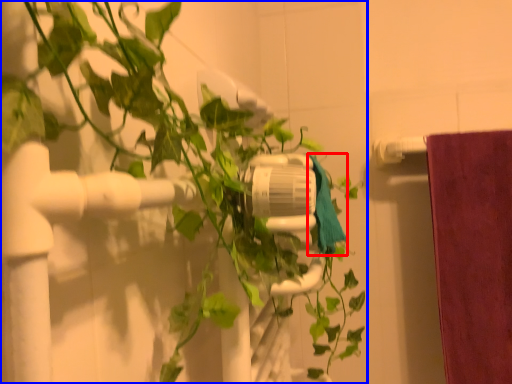
Question: Which point is closer to the camera, bath towel (highlighted by a red box) or houseplant (highlighted by a blue box)?

Choices:
 (A) bath towel
 (B) houseplant

Answer: (B)